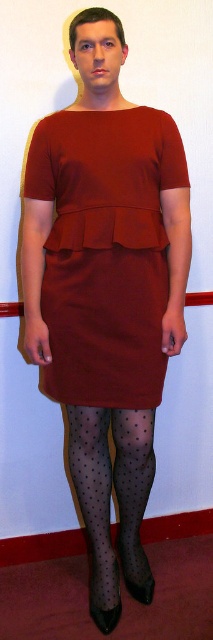
Question: Which point appears closest to the camera in this image?

Choices:
 (A) (90, 257)
 (B) (132, 480)

Answer: (A)

Question: Is burgundy matte dress at center below transparent polka dot tights at lower center?

Choices:
 (A) no
 (B) yes

Answer: (A)

Question: Which point appears farthest from the camera in this image?

Choices:
 (A) (115, 189)
 (B) (103, 579)

Answer: (B)

Question: Considering the relative positions of burgundy matte dress at center and transparent polka dot tights at lower center in the image provided, where is burgundy matte dress at center located with respect to transparent polka dot tights at lower center?

Choices:
 (A) below
 (B) above

Answer: (B)

Question: Is burgundy matte dress at center positioned before transparent polka dot tights at lower center?

Choices:
 (A) yes
 (B) no

Answer: (A)